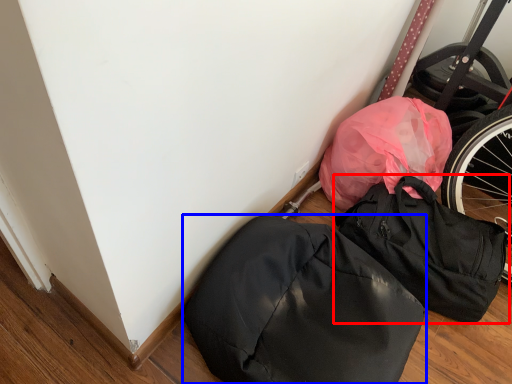
Question: Which point is further to the camera, backpack (highlighted by a red box) or backpack (highlighted by a blue box)?

Choices:
 (A) backpack
 (B) backpack

Answer: (A)